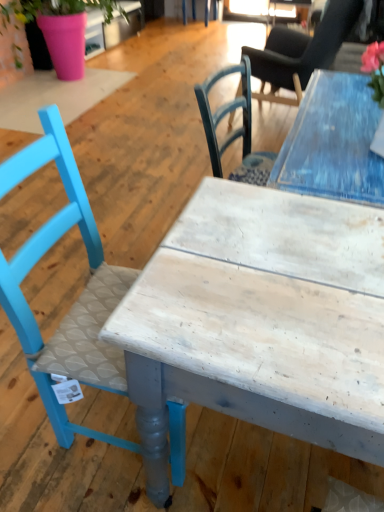
Question: Considering their positions, is smooth black chair at upper right, the 1th chair when ordered from top to bottom, located in front of or behind matte blue chair at left, placed as the second chair when sorted from right to left?

Choices:
 (A) front
 (B) behind

Answer: (B)

Question: Is point (302, 39) closer or farther from the camera than point (97, 367)?

Choices:
 (A) farther
 (B) closer

Answer: (A)

Question: Which of these objects is positioned closest to the white wood table at center?

Choices:
 (A) pink matte pot at upper left
 (B) matte blue chair at left, the 1th chair ordered from the bottom
 (C) smooth black chair at upper right, the 2th chair from the left

Answer: (B)

Question: Which object is the farthest from the matte blue chair at left, which ranks as the first chair in left-to-right order?

Choices:
 (A) pink matte pot at upper left
 (B) white wood table at center
 (C) smooth black chair at upper right, the 1th chair when ordered from top to bottom

Answer: (A)